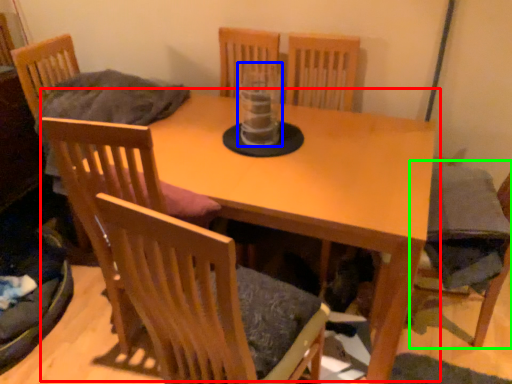
Question: Which object is the farthest from table (highlighted by a red box)? Choose among these: glass vase (highlighted by a blue box) or armchair (highlighted by a green box).

Choices:
 (A) glass vase
 (B) armchair

Answer: (B)